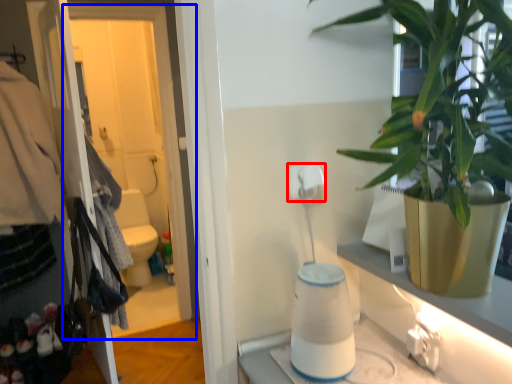
Question: Which object appears farthest to the camera in this image, toilet paper (highlighted by a red box) or screen door (highlighted by a blue box)?

Choices:
 (A) toilet paper
 (B) screen door

Answer: (B)